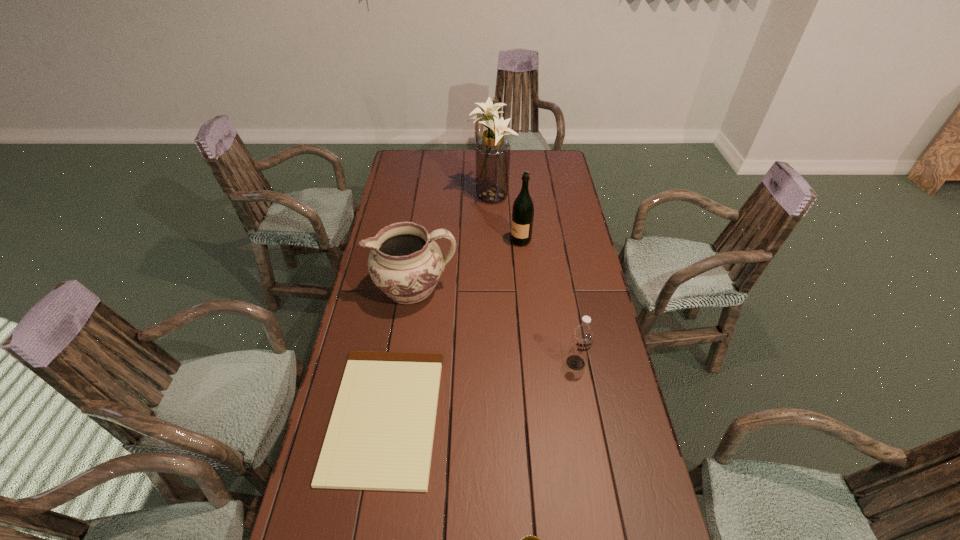
What are the coordinates of `flower arrangement` in the screenshot? It's located at (492, 152).

This screenshot has width=960, height=540. Identify the location of the farthest object. (492, 152).

Locate an element on the screen. This screenshot has width=960, height=540. liquor is located at coordinates (523, 210).

Where is `the fifth shortest object`? The width and height of the screenshot is (960, 540). the fifth shortest object is located at coordinates (523, 210).

You are a GUI agent. You are given a task and a screenshot of the screen. Output one action in this format:
    pyautogui.click(x=<x>, y=<y>)
    Task: Click on the third farthest object
    
    Given the screenshot: What is the action you would take?
    pyautogui.click(x=405, y=263)

Where is `the fourth shortest object`? The image size is (960, 540). the fourth shortest object is located at coordinates (405, 263).

The image size is (960, 540). I want to click on the rightmost object, so pos(582,335).

Where is `vodka`? This screenshot has width=960, height=540. vodka is located at coordinates (582, 335).

Where is `the shortest object`? The image size is (960, 540). the shortest object is located at coordinates (380, 437).

Find the location of a particular element. vacant region located 0.390m on the front of the flower arrangement is located at coordinates (493, 274).